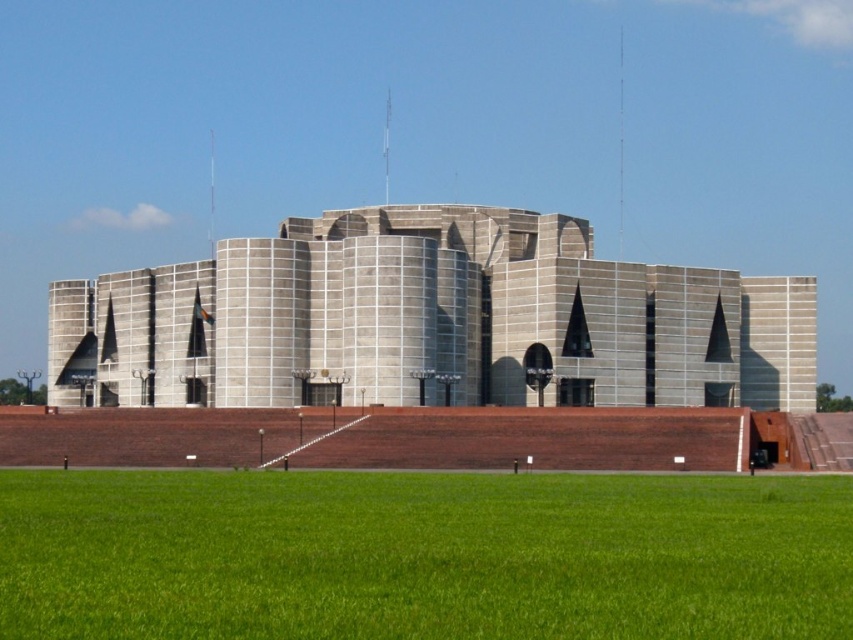
You are standing in front of the gray concrete building at center and want to walk towards the green grass at lower center. In which direction should you move relative to the building?

The green grass at lower center is to the right of the gray concrete building at center, so you should move to the right to reach it.

You are a landscape architect planning to install a new garden feature between the green grass at lower center and the gray concrete building at center. Considering their sizes, which area would be more suitable for placing a large sculpture?

The gray concrete building at center is larger than the green grass at lower center, so the area near the gray concrete building at center would be more suitable for placing a large sculpture.